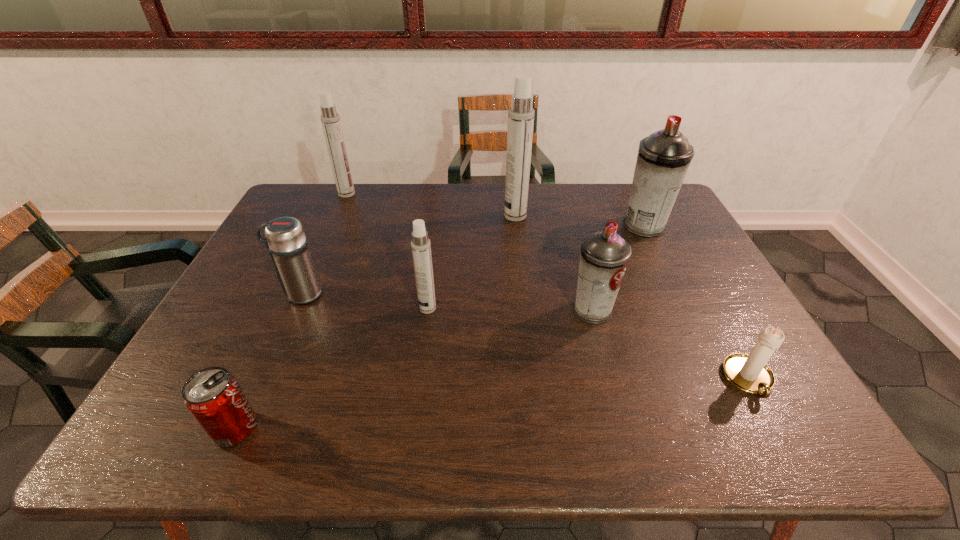
Locate an element on the screen. The image size is (960, 540). free region located 0.130m with a handle on the side of the third shortest object is located at coordinates (233, 294).

This screenshot has height=540, width=960. Identify the location of free space located 0.090m with a handle on the side of the third shortest object. 248,294.

Where is `vacant area situated on the handle side of the white candle holder`? The width and height of the screenshot is (960, 540). vacant area situated on the handle side of the white candle holder is located at coordinates (786, 448).

What are the coordinates of `vacant region located on the right of the pop soda` in the screenshot? It's located at (325, 428).

The width and height of the screenshot is (960, 540). Identify the location of object located at the near edge. (213, 396).

You are a GUI agent. You are given a task and a screenshot of the screen. Output one action in this format:
    pyautogui.click(x=<x>, y=<y>)
    Task: Click on the thermos bottle that is at the left edge
    This screenshot has height=540, width=960.
    Given the screenshot: What is the action you would take?
    pyautogui.click(x=285, y=239)

Locate an element on the screen. This screenshot has height=540, width=960. pop soda located at the left edge is located at coordinates (213, 396).

You are a GUI agent. You are given a task and a screenshot of the screen. Output one action in this format:
    pyautogui.click(x=<x>, y=<y>)
    Task: Click on the aerosol can present at the right edge
    
    Given the screenshot: What is the action you would take?
    pyautogui.click(x=663, y=159)

Where is `candle holder that is at the right edge`? candle holder that is at the right edge is located at coordinates (749, 373).

Locate an element on the screen. Image resolution: width=960 pixels, height=540 pixels. object situated at the near left corner is located at coordinates (213, 396).